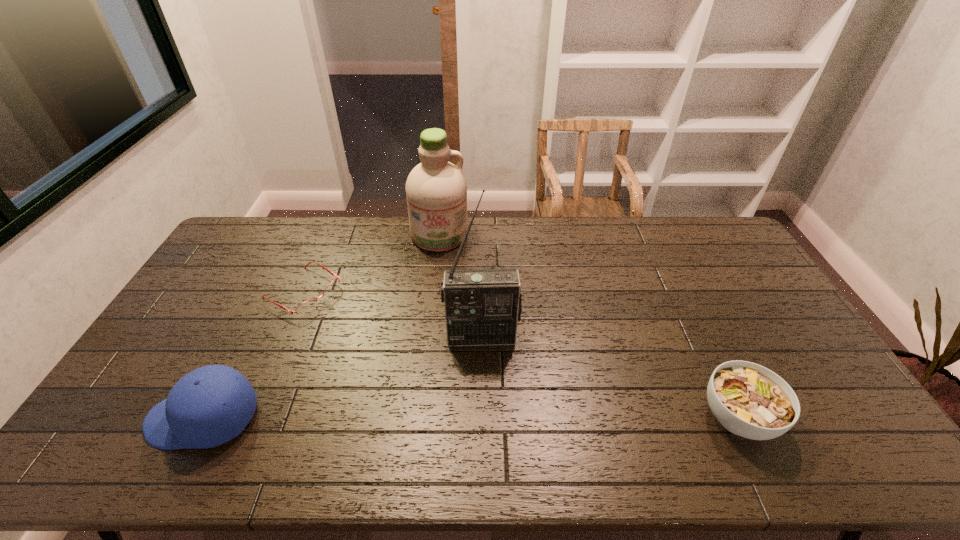
This screenshot has height=540, width=960. What are the coordinates of `cap` in the screenshot? It's located at (209, 406).

What are the coordinates of `the fourth tallest object` in the screenshot? It's located at tap(749, 400).

Locate an element on the screen. The height and width of the screenshot is (540, 960). the rightmost object is located at coordinates (749, 400).

At what (x,y) coordinates should I click in order to perform the action: click on radio receiver. Please return your answer as a coordinate pair (x, y). Looking at the image, I should click on point(482,306).

What are the coordinates of `the farthest object` in the screenshot? It's located at (436, 190).

Where is `cleansing agent`? Image resolution: width=960 pixels, height=540 pixels. cleansing agent is located at coordinates (436, 190).

At what (x,y) coordinates should I click in order to perform the action: click on the shortest object. Please return your answer as a coordinate pair (x, y). Looking at the image, I should click on 308,305.

You are a GUI agent. You are given a task and a screenshot of the screen. Output one action in this format:
    pyautogui.click(x=<x>, y=<y>)
    Task: Click on the fourth nearest object
    Image resolution: width=960 pixels, height=540 pixels.
    Given the screenshot: What is the action you would take?
    pyautogui.click(x=308, y=305)

You are a GUI agent. You are given a task and a screenshot of the screen. Output one action in this format:
    pyautogui.click(x=<x>, y=<y>)
    Task: Click on the free region located on the front-facing side of the cap
    
    Given the screenshot: What is the action you would take?
    pyautogui.click(x=107, y=418)

At what (x,y) coordinates should I click in order to perform the action: click on vacant position located 0.070m on the front-facing side of the cap. Please return your answer as a coordinate pair (x, y). Image resolution: width=960 pixels, height=540 pixels. Looking at the image, I should click on (122, 418).